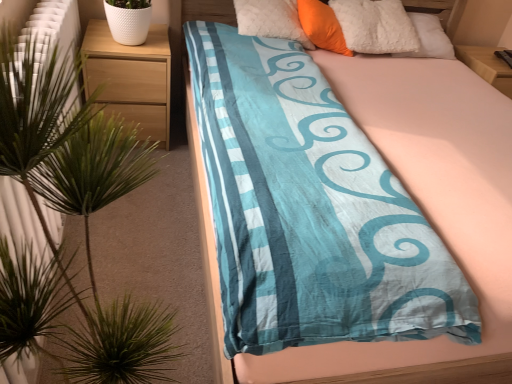
Question: From a real-world perspective, is wooden nightstand at left located beneath orange soft pillow at upper center?

Choices:
 (A) yes
 (B) no

Answer: (A)

Question: Is the position of wooden nightstand at left more distant than that of orange soft pillow at upper center?

Choices:
 (A) no
 (B) yes

Answer: (A)

Question: Could you tell me if wooden nightstand at left is turned towards orange soft pillow at upper center?

Choices:
 (A) no
 (B) yes

Answer: (A)

Question: Is orange soft pillow at upper center completely or partially inside wooden nightstand at left?

Choices:
 (A) no
 (B) yes

Answer: (A)

Question: Does wooden nightstand at left appear on the left side of orange soft pillow at upper center?

Choices:
 (A) no
 (B) yes

Answer: (B)

Question: Is wooden nightstand at left not inside orange soft pillow at upper center?

Choices:
 (A) no
 (B) yes

Answer: (B)

Question: Is wooden nightstand at left at the back of green leafy plant at left?

Choices:
 (A) yes
 (B) no

Answer: (B)

Question: Is green leafy plant at left thinner than wooden nightstand at left?

Choices:
 (A) no
 (B) yes

Answer: (B)

Question: Would you say wooden nightstand at left is part of green leafy plant at left's contents?

Choices:
 (A) no
 (B) yes

Answer: (A)

Question: Is green leafy plant at left oriented towards wooden nightstand at left?

Choices:
 (A) no
 (B) yes

Answer: (A)

Question: Is green leafy plant at left smaller than wooden nightstand at left?

Choices:
 (A) yes
 (B) no

Answer: (B)

Question: Is green leafy plant at left in front of wooden nightstand at left?

Choices:
 (A) no
 (B) yes

Answer: (B)

Question: Does green leafy plant at left have a larger size compared to blue cotton bed at center?

Choices:
 (A) no
 (B) yes

Answer: (A)